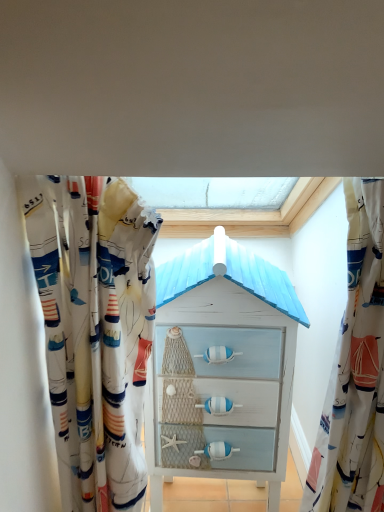
Question: From the image's perspective, is white fabric curtain at right, the 2th curtain from the left, on top of white painted wood chest of drawers at center?

Choices:
 (A) no
 (B) yes

Answer: (B)

Question: Considering the relative sizes of white fabric curtain at right, the 2th curtain from the left, and white painted wood chest of drawers at center in the image provided, is white fabric curtain at right, the 2th curtain from the left, taller than white painted wood chest of drawers at center?

Choices:
 (A) no
 (B) yes

Answer: (A)

Question: Is the position of white fabric curtain at right, the 2th curtain from the left, more distant than that of white painted wood chest of drawers at center?

Choices:
 (A) no
 (B) yes

Answer: (A)

Question: Could you tell me if white fabric curtain at right, the 2th curtain from the left, is facing white painted wood chest of drawers at center?

Choices:
 (A) yes
 (B) no

Answer: (B)

Question: Does white fabric curtain at right, arranged as the 1th curtain when viewed from the right, have a lesser width compared to white painted wood chest of drawers at center?

Choices:
 (A) yes
 (B) no

Answer: (A)

Question: Relative to white fabric curtain at right, the 2th curtain from the left, is white fabric curtain at left, the first curtain from the left, in front or behind?

Choices:
 (A) behind
 (B) front

Answer: (B)

Question: Is white fabric curtain at left, the 2th curtain from the right, inside or outside of white fabric curtain at right, the 2th curtain from the left?

Choices:
 (A) inside
 (B) outside

Answer: (B)

Question: From a real-world perspective, is white fabric curtain at left, the 2th curtain from the right, above or below white fabric curtain at right, arranged as the 1th curtain when viewed from the right?

Choices:
 (A) below
 (B) above

Answer: (B)

Question: Is white fabric curtain at left, the first curtain from the left, bigger or smaller than white fabric curtain at right, the 2th curtain from the left?

Choices:
 (A) small
 (B) big

Answer: (B)

Question: Is white fabric curtain at left, the 2th curtain from the right, to the left or to the right of white painted wood chest of drawers at center in the image?

Choices:
 (A) left
 (B) right

Answer: (A)

Question: In terms of size, does white fabric curtain at left, the first curtain from the left, appear bigger or smaller than white painted wood chest of drawers at center?

Choices:
 (A) small
 (B) big

Answer: (A)

Question: In terms of width, does white fabric curtain at left, the 2th curtain from the right, look wider or thinner when compared to white painted wood chest of drawers at center?

Choices:
 (A) wide
 (B) thin

Answer: (B)

Question: Do you think white fabric curtain at left, the 2th curtain from the right, is within white painted wood chest of drawers at center, or outside of it?

Choices:
 (A) inside
 (B) outside

Answer: (B)

Question: From the image's perspective, is white fabric curtain at right, arranged as the 1th curtain when viewed from the right, positioned above or below white fabric curtain at left, the first curtain from the left?

Choices:
 (A) above
 (B) below

Answer: (B)

Question: Is white fabric curtain at right, the 2th curtain from the left, in front of or behind white fabric curtain at left, the 2th curtain from the right, in the image?

Choices:
 (A) behind
 (B) front

Answer: (A)